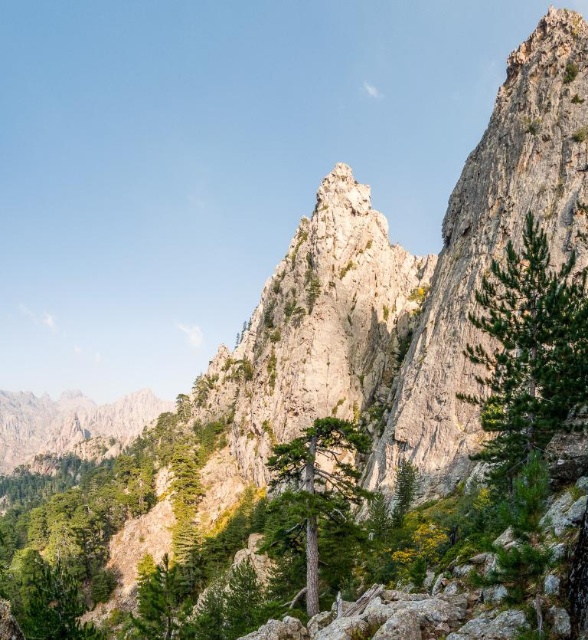
You are a hiker standing at the base of the mountain and see the green rough bark tree at right and the green rough bark tree at center. Which tree is positioned higher up the mountain?

The green rough bark tree at right is positioned higher up the mountain than the green rough bark tree at center.

You are a hiker who wants to take a photo of both the green rough bark tree at right and the green rough bark tree at center from a single viewpoint. Which tree should you position yourself closer to in order to include both in the frame without cropping either?

You should position yourself closer to the green rough bark tree at center because it is shorter than the green rough bark tree at right. By being nearer to the shorter tree, you can ensure both trees fit within the camera frame without cropping.